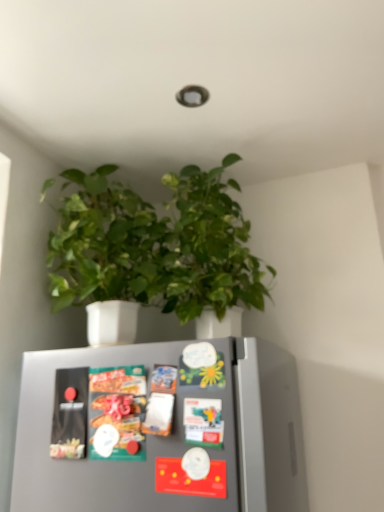
Where is `metallic silver fridge magnets at center`? This screenshot has height=512, width=384. metallic silver fridge magnets at center is located at coordinates (171, 437).

At what (x,y) coordinates should I click in order to perform the action: click on matte plastic snack packet at center. Please return your answer as a coordinate pair (x, y). This screenshot has height=512, width=384. Looking at the image, I should click on (117, 413).

Relative to green matte plant at upper center, is metallic silver fridge magnets at center in front or behind?

Visually, metallic silver fridge magnets at center is located in front of green matte plant at upper center.

Considering the sizes of metallic silver fridge magnets at center and green matte plant at upper center in the image, is metallic silver fridge magnets at center wider or thinner than green matte plant at upper center?

In the image, metallic silver fridge magnets at center appears to be more narrow than green matte plant at upper center.

Considering the sizes of objects metallic silver fridge magnets at center and green matte plant at upper center in the image provided, who is shorter, metallic silver fridge magnets at center or green matte plant at upper center?

With less height is metallic silver fridge magnets at center.

Considering the points (112, 462) and (239, 263), which point is in front, point (112, 462) or point (239, 263)?

The point (112, 462) is in front.

Which object is more forward, green matte plant at upper center or metallic silver fridge magnets at center?

metallic silver fridge magnets at center is more forward.

Can you confirm if green matte plant at upper center is positioned to the right of metallic silver fridge magnets at center?

Yes.

Is the surface of green matte plant at upper center in direct contact with metallic silver fridge magnets at center?

green matte plant at upper center and metallic silver fridge magnets at center are not in contact.

Who is taller, matte plastic snack packet at center or metallic silver fridge magnets at center?

With more height is metallic silver fridge magnets at center.

Is point (121, 369) closer to viewer compared to point (203, 483)?

That is False.

Based on the photo, from a real-world perspective, is matte plastic snack packet at center positioned over metallic silver fridge magnets at center based on gravity?

Indeed, from a real-world perspective, matte plastic snack packet at center stands above metallic silver fridge magnets at center.

In the scene shown: Which is behind, matte plastic snack packet at center or green matte plant at upper center?

green matte plant at upper center is more distant.

Who is smaller, matte plastic snack packet at center or green matte plant at upper center?

Smaller between the two is matte plastic snack packet at center.

Is matte plastic snack packet at center far from green matte plant at upper center?

No, there isn't a large distance between matte plastic snack packet at center and green matte plant at upper center.

Does matte plastic snack packet at center have a lesser width compared to green matte plant at upper center?

Correct, the width of matte plastic snack packet at center is less than that of green matte plant at upper center.

Considering the relative sizes of green matte plant at upper center and matte plastic snack packet at center in the image provided, is green matte plant at upper center bigger than matte plastic snack packet at center?

Correct, green matte plant at upper center is larger in size than matte plastic snack packet at center.

Which is in front, point (102, 193) or point (144, 403)?

Point (144, 403)

From a real-world perspective, between green matte plant at upper center and matte plastic snack packet at center, who is vertically lower?

matte plastic snack packet at center is physically lower.

What's the angular difference between green matte plant at upper center and matte plastic snack packet at center's facing directions?

The angular difference between green matte plant at upper center and matte plastic snack packet at center is 1.8 degrees.

From a real-world perspective, relative to matte plastic snack packet at center, is metallic silver fridge magnets at center vertically above or below?

metallic silver fridge magnets at center is below matte plastic snack packet at center.

Is metallic silver fridge magnets at center directly adjacent to matte plastic snack packet at center?

There is a gap between metallic silver fridge magnets at center and matte plastic snack packet at center.

Does metallic silver fridge magnets at center turn towards matte plastic snack packet at center?

Yes, metallic silver fridge magnets at center is facing matte plastic snack packet at center.

Between metallic silver fridge magnets at center and matte plastic snack packet at center, which one has more height?

Standing taller between the two is metallic silver fridge magnets at center.

What are the coordinates of `houseplant behind the metallic silver fridge magnets at center` in the screenshot? It's located at (155, 245).

This screenshot has height=512, width=384. In order to click on refrigerator located on the left of green matte plant at upper center in this screenshot , I will do `click(171, 437)`.

From the picture: When comparing their distances from matte plastic snack packet at center, does green matte plant at upper center or metallic silver fridge magnets at center seem further?

green matte plant at upper center.

From the image, which object appears to be nearer to matte plastic snack packet at center, metallic silver fridge magnets at center or green matte plant at upper center?

Based on the image, metallic silver fridge magnets at center appears to be nearer to matte plastic snack packet at center.

Which object lies further to the anchor point metallic silver fridge magnets at center, matte plastic snack packet at center or green matte plant at upper center?

green matte plant at upper center.

Based on their spatial positions, is green matte plant at upper center or matte plastic snack packet at center further from metallic silver fridge magnets at center?

The object further to metallic silver fridge magnets at center is green matte plant at upper center.

Estimate the real-world distances between objects in this image. Which object is further from green matte plant at upper center, metallic silver fridge magnets at center or matte plastic snack packet at center?

matte plastic snack packet at center.

From the image, which object appears to be nearer to green matte plant at upper center, matte plastic snack packet at center or metallic silver fridge magnets at center?

Based on the image, metallic silver fridge magnets at center appears to be nearer to green matte plant at upper center.

Identify the location of food between green matte plant at upper center and metallic silver fridge magnets at center from top to bottom. [117, 413].